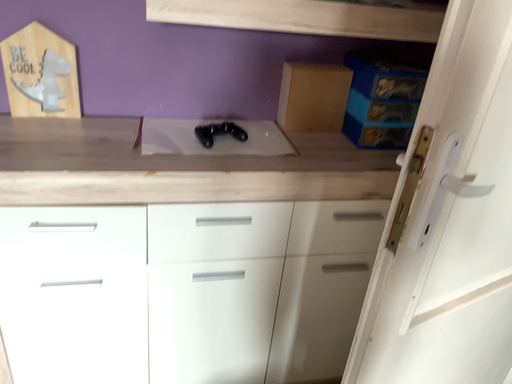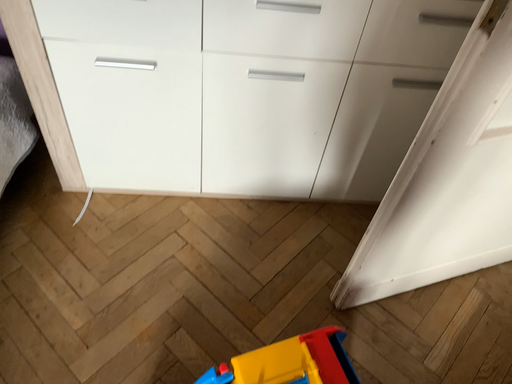
Question: Which way did the camera rotate in the video?

Choices:
 (A) rotated left
 (B) rotated right

Answer: (A)